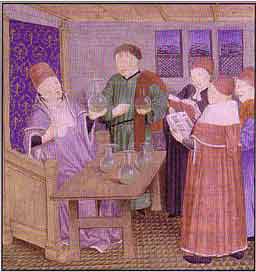
I want to click on throne, so click(x=28, y=42).